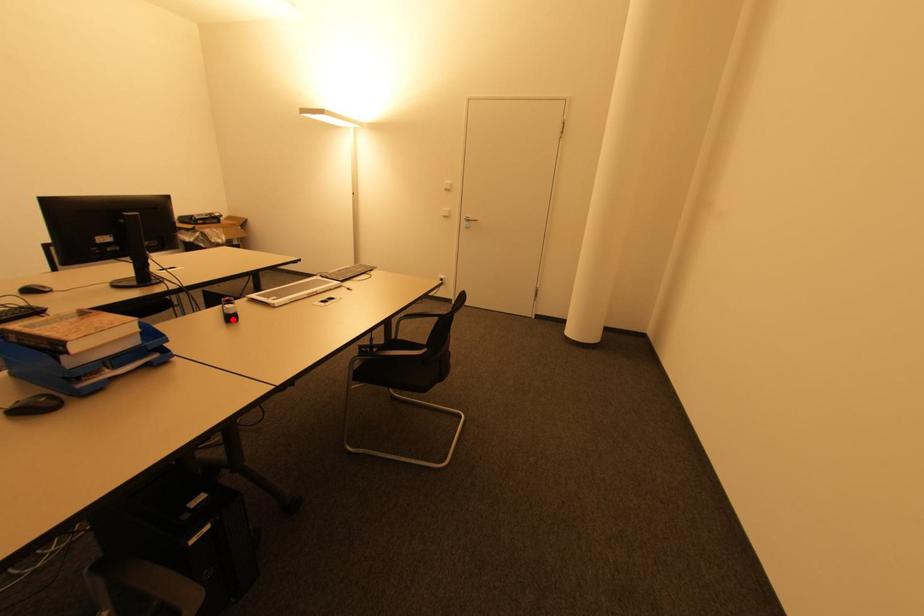
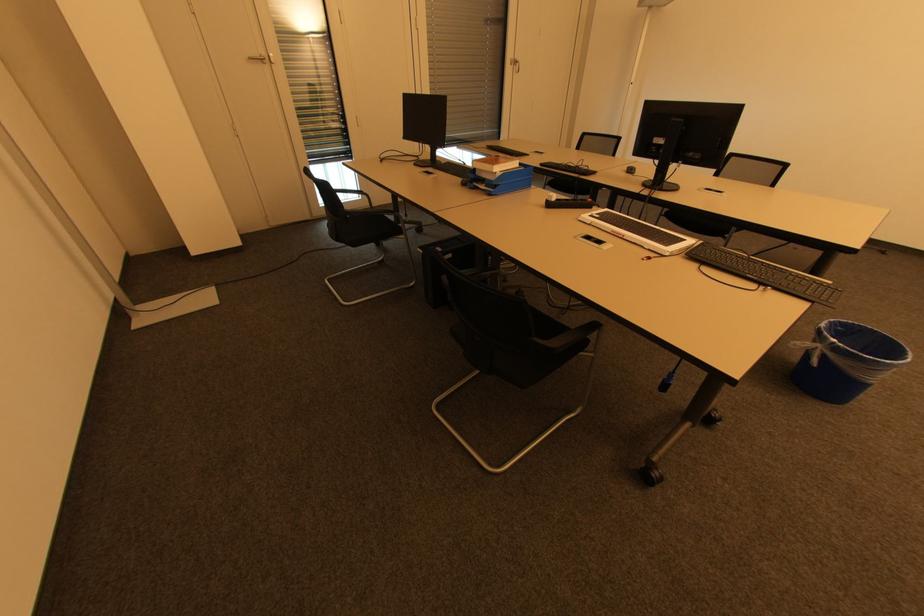
In the second image, find the point that corresponds to the highlighted location in the first image.

(551, 206)